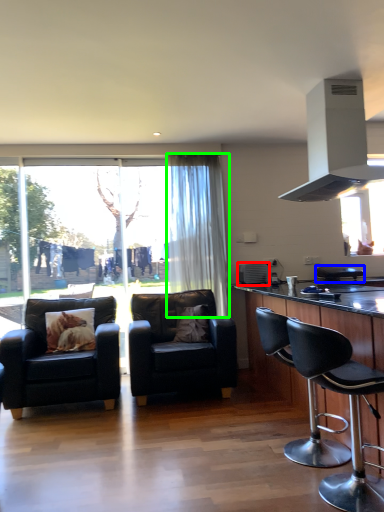
Question: Which is nearer to the appliance (highlighted by a red box)? chair (highlighted by a blue box) or curtain (highlighted by a green box).

Choices:
 (A) chair
 (B) curtain

Answer: (B)